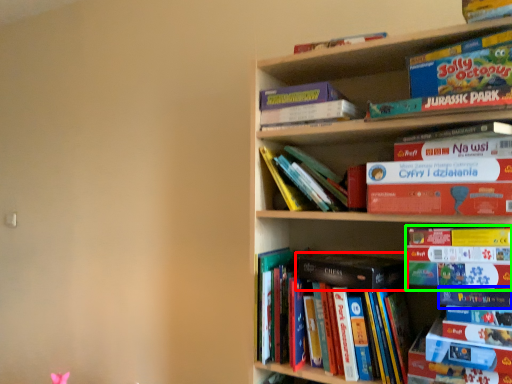
Question: Considering the real-world distances, which object is closest to paperback book (highlighted by a red box)? book (highlighted by a blue box) or book (highlighted by a green box).

Choices:
 (A) book
 (B) book

Answer: (B)